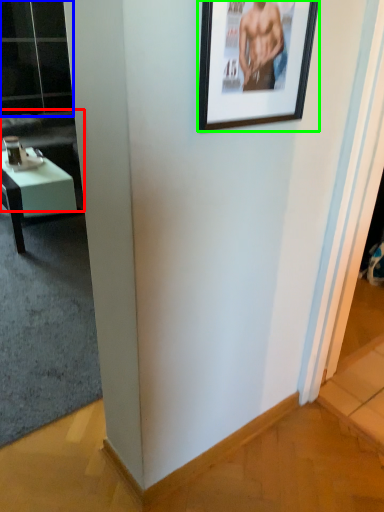
Question: Based on their relative distances, which object is farther from couch (highlighted by a red box)? Choose from glass door (highlighted by a blue box) and picture frame (highlighted by a green box).

Choices:
 (A) glass door
 (B) picture frame

Answer: (B)